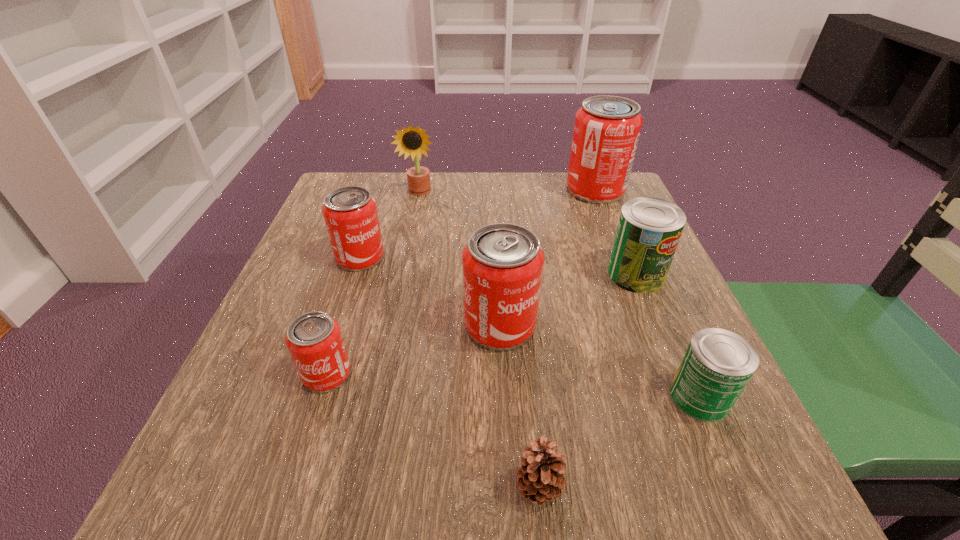
Find the location of a particular element. The image size is (960, 540). vacant space situated 0.390m on the front of the rightmost red can is located at coordinates (647, 322).

Locate an element on the screen. vacant region located 0.370m on the face of the yellow sunflower is located at coordinates (396, 307).

Locate an element on the screen. vacant space situated on the back of the second nearest red can is located at coordinates (497, 273).

Where is `vacant space located 0.090m on the back of the third nearest red can`? The height and width of the screenshot is (540, 960). vacant space located 0.090m on the back of the third nearest red can is located at coordinates (372, 220).

I want to click on free point located on the left of the bigger green can, so click(408, 274).

The image size is (960, 540). What are the coordinates of `vacant area situated on the front of the smallest red can` in the screenshot? It's located at (305, 444).

Where is `free space located 0.190m on the back of the nearer green can`? free space located 0.190m on the back of the nearer green can is located at coordinates [x=655, y=292].

Where is `vacant space located on the back of the pinecone`? vacant space located on the back of the pinecone is located at coordinates (519, 281).

Find the location of a particular element. The width and height of the screenshot is (960, 540). can located in the far edge section of the desktop is located at coordinates (606, 132).

This screenshot has height=540, width=960. I want to click on sunflower at the far edge, so [x=413, y=141].